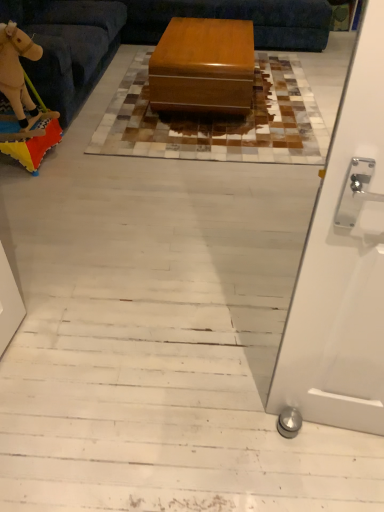
Question: Is wooden toy horse at left surrounding glossy wood table at center?

Choices:
 (A) yes
 (B) no

Answer: (B)

Question: Does wooden toy horse at left have a greater height compared to glossy wood table at center?

Choices:
 (A) no
 (B) yes

Answer: (B)

Question: Does wooden toy horse at left have a lesser width compared to glossy wood table at center?

Choices:
 (A) yes
 (B) no

Answer: (B)

Question: From a real-world perspective, is wooden toy horse at left on top of glossy wood table at center?

Choices:
 (A) yes
 (B) no

Answer: (A)

Question: Is wooden toy horse at left completely or partially outside of glossy wood table at center?

Choices:
 (A) no
 (B) yes

Answer: (B)

Question: From the image's perspective, is velvet blue couch at upper center located above or below velvety beige rocking horse at left?

Choices:
 (A) below
 (B) above

Answer: (B)

Question: From a real-world perspective, is velvet blue couch at upper center positioned above or below velvety beige rocking horse at left?

Choices:
 (A) below
 (B) above

Answer: (A)

Question: Is velvet blue couch at upper center wider or thinner than velvety beige rocking horse at left?

Choices:
 (A) wide
 (B) thin

Answer: (A)

Question: In terms of size, does velvet blue couch at upper center appear bigger or smaller than velvety beige rocking horse at left?

Choices:
 (A) big
 (B) small

Answer: (A)

Question: From the image's perspective, relative to velvety beige rocking horse at left, is leather-like brown mat at center above or below?

Choices:
 (A) below
 (B) above

Answer: (B)

Question: Does point (279, 108) appear closer or farther from the camera than point (38, 117)?

Choices:
 (A) closer
 (B) farther

Answer: (B)

Question: Which is correct: leather-like brown mat at center is inside velvety beige rocking horse at left, or outside of it?

Choices:
 (A) inside
 (B) outside

Answer: (B)

Question: Based on their sizes in the image, would you say leather-like brown mat at center is bigger or smaller than velvety beige rocking horse at left?

Choices:
 (A) big
 (B) small

Answer: (A)

Question: Is glossy wood table at center bigger or smaller than leather-like brown mat at center?

Choices:
 (A) big
 (B) small

Answer: (A)

Question: From the image's perspective, is glossy wood table at center above or below leather-like brown mat at center?

Choices:
 (A) below
 (B) above

Answer: (B)